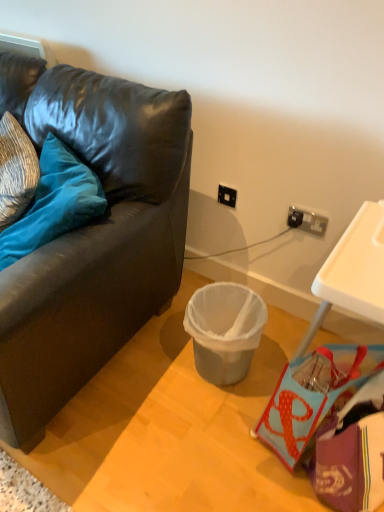
Question: Is purple fabric handbag at lower right at the right side of gray plastic trash can at center?

Choices:
 (A) yes
 (B) no

Answer: (A)

Question: From a real-world perspective, is purple fabric handbag at lower right positioned over gray plastic trash can at center based on gravity?

Choices:
 (A) yes
 (B) no

Answer: (A)

Question: From the image's perspective, does purple fabric handbag at lower right appear lower than gray plastic trash can at center?

Choices:
 (A) yes
 (B) no

Answer: (A)

Question: Considering the relative sizes of purple fabric handbag at lower right and gray plastic trash can at center in the image provided, is purple fabric handbag at lower right taller than gray plastic trash can at center?

Choices:
 (A) yes
 (B) no

Answer: (A)

Question: Can we say purple fabric handbag at lower right lies outside gray plastic trash can at center?

Choices:
 (A) no
 (B) yes

Answer: (B)

Question: Considering the relative positions of purple fabric handbag at lower right and gray plastic trash can at center in the image provided, is purple fabric handbag at lower right in front of gray plastic trash can at center?

Choices:
 (A) no
 (B) yes

Answer: (B)

Question: Can you see black plastic power outlet at upper right, which is counted as the first power outlet, starting from the back, touching gray plastic trash can at center?

Choices:
 (A) no
 (B) yes

Answer: (A)

Question: From a real-world perspective, does black plastic power outlet at upper right, which is counted as the first power outlet, starting from the back, stand above gray plastic trash can at center?

Choices:
 (A) no
 (B) yes

Answer: (B)

Question: Can you confirm if black plastic power outlet at upper right, marked as the second power outlet in a front-to-back arrangement, is shorter than gray plastic trash can at center?

Choices:
 (A) no
 (B) yes

Answer: (B)

Question: From the image's perspective, is black plastic power outlet at upper right, which is counted as the 2th power outlet, starting from the right, beneath gray plastic trash can at center?

Choices:
 (A) yes
 (B) no

Answer: (B)

Question: Can you confirm if black plastic power outlet at upper right, marked as the second power outlet in a front-to-back arrangement, is bigger than gray plastic trash can at center?

Choices:
 (A) no
 (B) yes

Answer: (A)

Question: Considering the relative sizes of black plastic power outlet at upper right, the first power outlet in the top-to-bottom sequence, and gray plastic trash can at center in the image provided, is black plastic power outlet at upper right, the first power outlet in the top-to-bottom sequence, wider than gray plastic trash can at center?

Choices:
 (A) no
 (B) yes

Answer: (A)

Question: Is velvet blue pillow at left positioned beyond the bounds of gray plastic trash can at center?

Choices:
 (A) yes
 (B) no

Answer: (A)